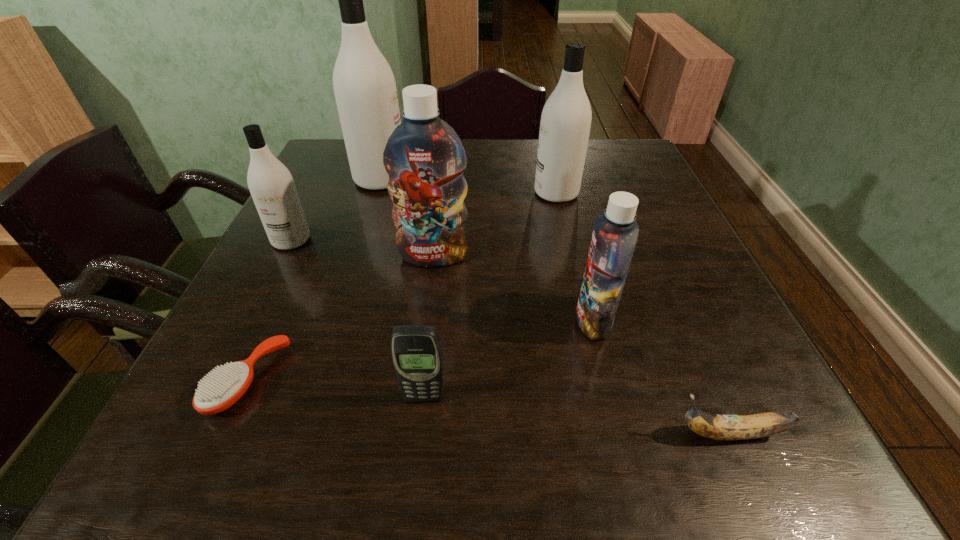
This screenshot has height=540, width=960. In order to click on banana that is at the near edge in this screenshot , I will do `click(717, 427)`.

Identify the location of hairbrush at the near edge. Image resolution: width=960 pixels, height=540 pixels. (217, 392).

Where is `hairbrush present at the left edge`? This screenshot has width=960, height=540. hairbrush present at the left edge is located at coordinates (217, 392).

This screenshot has width=960, height=540. Find the location of `object that is at the right edge`. object that is at the right edge is located at coordinates (717, 427).

Find the location of a particular element. object located in the far left corner section of the desktop is located at coordinates (365, 89).

Image resolution: width=960 pixels, height=540 pixels. Identify the location of object located in the near left corner section of the desktop. (217, 392).

I want to click on object that is at the near right corner, so click(717, 427).

The height and width of the screenshot is (540, 960). I want to click on vacant space at the far edge of the desktop, so click(x=527, y=139).

The image size is (960, 540). In the image, there is a desktop. In order to click on vacant space at the near edge in this screenshot , I will do coord(516,435).

Where is `vacant region at the left edge of the desktop`? This screenshot has height=540, width=960. vacant region at the left edge of the desktop is located at coordinates (324, 285).